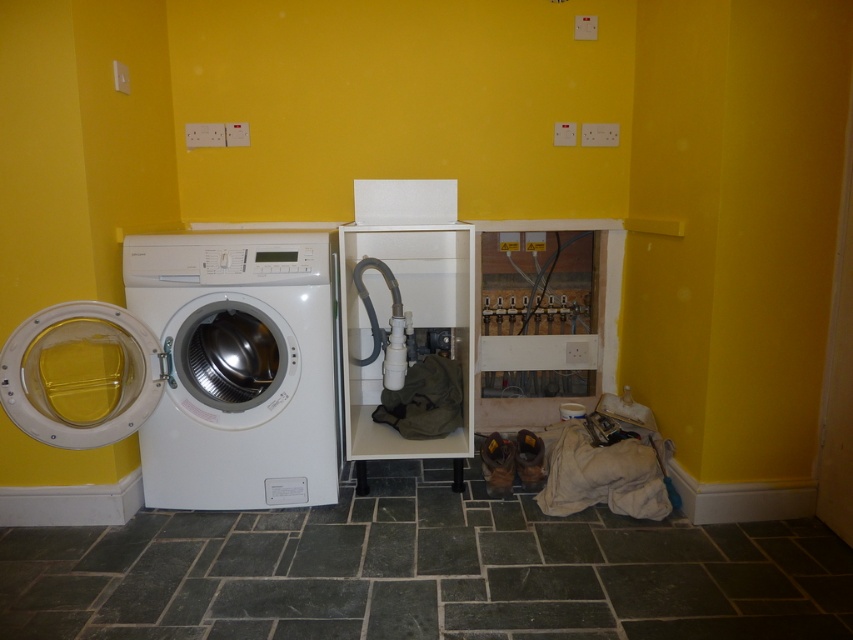
Can you confirm if white glossy cabinet at center is smaller than green fabric laundry at center?

No, white glossy cabinet at center is not smaller than green fabric laundry at center.

Is white glossy cabinet at center above green fabric laundry at center?

Yes.

This screenshot has height=640, width=853. Find the location of `white glossy cabinet at center`. white glossy cabinet at center is located at coordinates (407, 323).

Consider the image. Can you confirm if beige fabric laundry at lower right is positioned below green fabric laundry at center?

Correct, beige fabric laundry at lower right is located below green fabric laundry at center.

From the picture: Does beige fabric laundry at lower right lie behind green fabric laundry at center?

No, it is not.

Who is more distant from viewer, (645,508) or (410,384)?

The point (410,384) is behind.

You are a GUI agent. You are given a task and a screenshot of the screen. Output one action in this format:
    pyautogui.click(x=<x>, y=<y>)
    Task: Click on the beige fabric laundry at lower right
    Image resolution: width=853 pixels, height=640 pixels.
    Given the screenshot: What is the action you would take?
    pyautogui.click(x=601, y=474)

Does white glossy washing machine at left have a greater width compared to white glossy cabinet at center?

Yes.

Is white glossy washing machine at left thinner than white glossy cabinet at center?

No, white glossy washing machine at left is not thinner than white glossy cabinet at center.

What do you see at coordinates (216, 369) in the screenshot?
I see `white glossy washing machine at left` at bounding box center [216, 369].

The image size is (853, 640). I want to click on white glossy washing machine at left, so click(x=216, y=369).